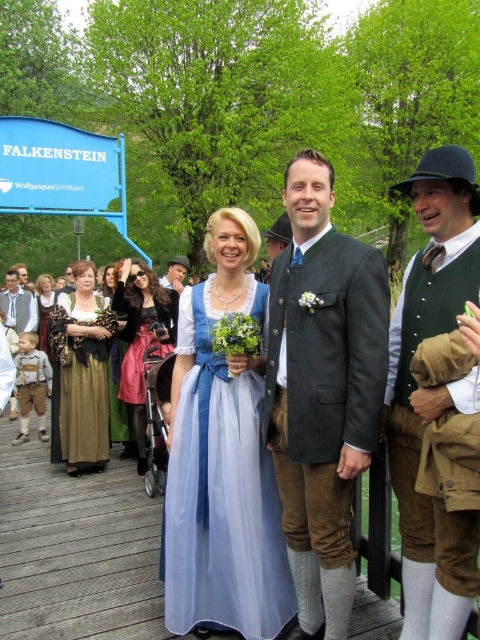
You are standing at the festival near Lake Wolfgangsee and see two points marked on the ground. The first point is at coordinates point (148,328) and the second is at point (109,294). Which point is closer to you?

Point (148,328) is in front of point (109,294), so it is closer to you.

Consider the image. You are a photographer at the festival and want to take a photo of both the velvet pink dress at center and the matte brown dress at center. Which dress should you focus on first to ensure both are in focus?

You should focus on the velvet pink dress at center first because it is closer to the viewer than the matte brown dress at center, so adjusting focus from near to far will help both be in focus.

You are a photographer at the festival and want to capture both the light blue satin dirndl at center and the matte brown dirndl at center in a single frame. Which dirndl should you focus on first to ensure both are in the shot?

The light blue satin dirndl at center is smaller than the matte brown dirndl at center, so you should focus on the matte brown dirndl at center first to ensure both are in the shot.